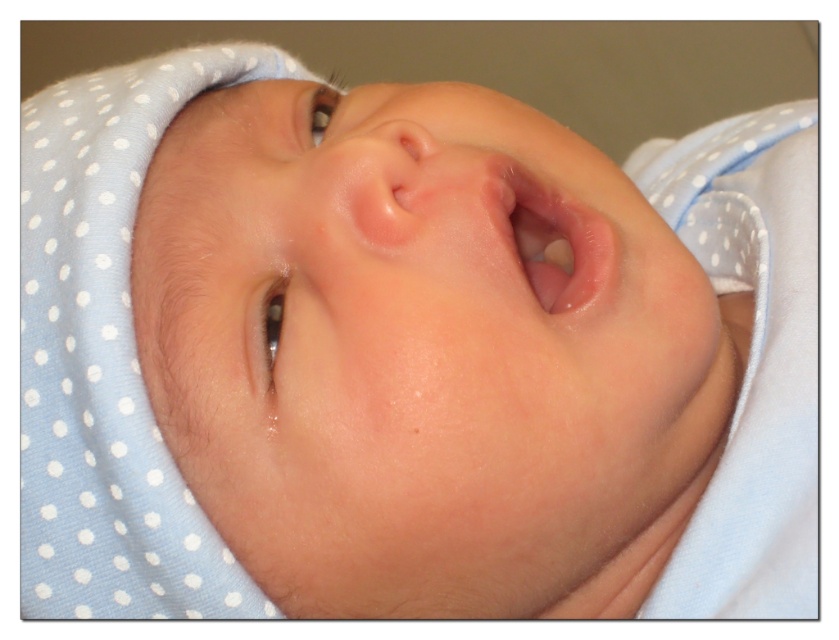
You are a photographer adjusting the focus on your camera. The subject is a newborn baby with smooth skin face at center. Where should you position the focus point to capture the baby smoothly?

The smooth skin face at center is located at point (x=423, y=353), so you should position the focus point at coordinates (x=423, y=353) to ensure the baby is in sharp focus.